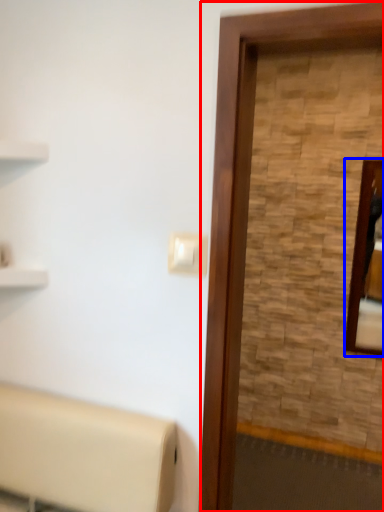
Question: Which object appears farthest to the camera in this image, screen door (highlighted by a red box) or mirror (highlighted by a blue box)?

Choices:
 (A) screen door
 (B) mirror

Answer: (B)